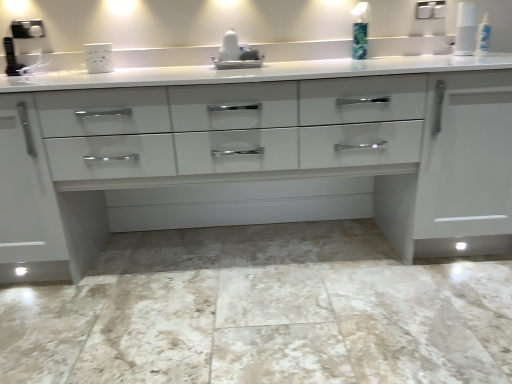
Question: Is white glossy sink at center bigger than marble tile floor at center?

Choices:
 (A) no
 (B) yes

Answer: (A)

Question: From a real-world perspective, is white glossy sink at center below marble tile floor at center?

Choices:
 (A) yes
 (B) no

Answer: (B)

Question: Is white glossy sink at center positioned behind marble tile floor at center?

Choices:
 (A) no
 (B) yes

Answer: (B)

Question: Can you confirm if white glossy sink at center is thinner than marble tile floor at center?

Choices:
 (A) no
 (B) yes

Answer: (B)

Question: Is white glossy sink at center far from marble tile floor at center?

Choices:
 (A) no
 (B) yes

Answer: (B)

Question: Can you confirm if white glossy sink at center is positioned to the left of marble tile floor at center?

Choices:
 (A) no
 (B) yes

Answer: (B)

Question: Can you confirm if marble tile floor at center is thinner than white matte mug at upper center?

Choices:
 (A) yes
 (B) no

Answer: (B)

Question: Can white matte mug at upper center be found inside marble tile floor at center?

Choices:
 (A) no
 (B) yes

Answer: (A)

Question: From the image's perspective, is marble tile floor at center under white matte mug at upper center?

Choices:
 (A) yes
 (B) no

Answer: (A)

Question: Are marble tile floor at center and white matte mug at upper center making contact?

Choices:
 (A) yes
 (B) no

Answer: (B)

Question: Can you confirm if marble tile floor at center is smaller than white matte mug at upper center?

Choices:
 (A) no
 (B) yes

Answer: (A)

Question: Is marble tile floor at center further to the viewer compared to white matte mug at upper center?

Choices:
 (A) no
 (B) yes

Answer: (A)

Question: Is green plastic soap dispenser at upper right smaller than white matte mug at upper center?

Choices:
 (A) no
 (B) yes

Answer: (B)